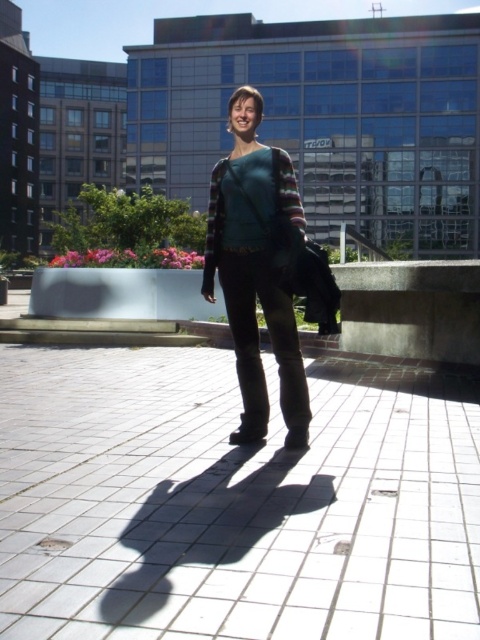
You are standing at the edge of the white tile pavement at center and want to move towards the teal knitted sweater at center. Which direction should you move to reach the sweater?

You should move to the left to reach the teal knitted sweater at center because the white tile pavement at center is located to the right of the sweater.

You are a delivery person standing on the white tile pavement at center and need to place a package under the matte teal sweater at center. Is the package likely to fit underneath the sweater?

The white tile pavement at center is below matte teal sweater at center, so the package can be placed on the pavement under the sweater.